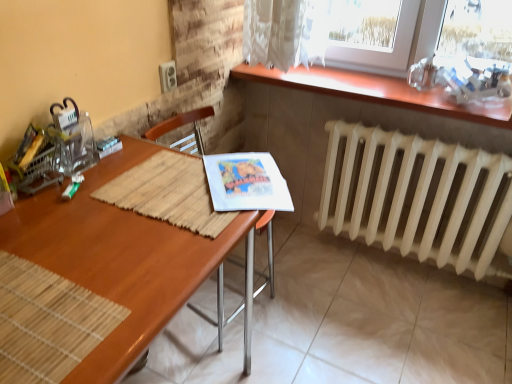
Question: Is point (258, 273) positioned closer to the camera than point (505, 117)?

Choices:
 (A) closer
 (B) farther

Answer: (B)

Question: Which is correct: wooden chair at center is inside wooden table at upper right, or outside of it?

Choices:
 (A) outside
 (B) inside

Answer: (A)

Question: Based on their relative distances, which object is nearer to the wooden table at upper right?

Choices:
 (A) wooden desk at center
 (B) wooden chair at center
 (C) white matte radiator at lower right

Answer: (C)

Question: Considering the real-world distances, which object is closest to the wooden table at upper right?

Choices:
 (A) white matte radiator at lower right
 (B) wooden desk at center
 (C) wooden chair at center

Answer: (A)